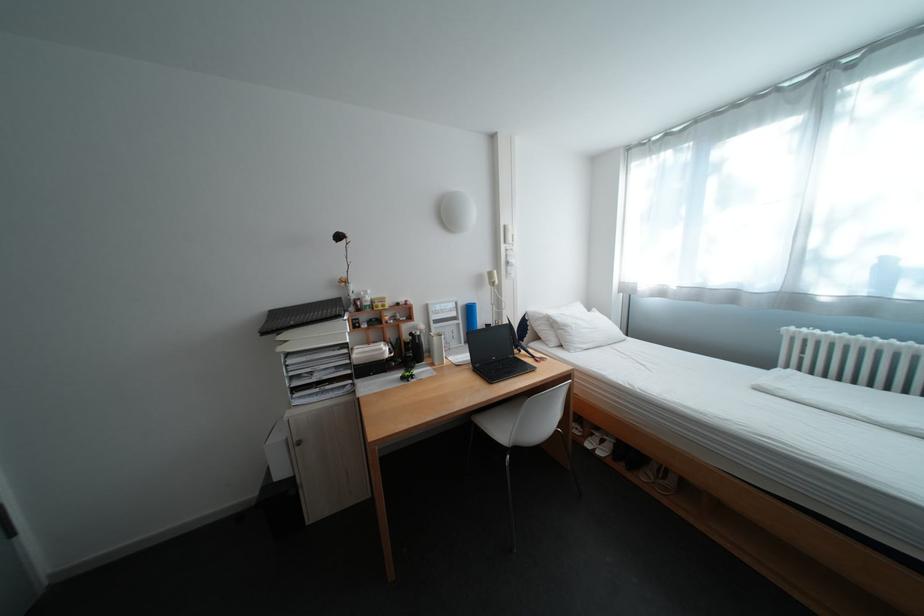
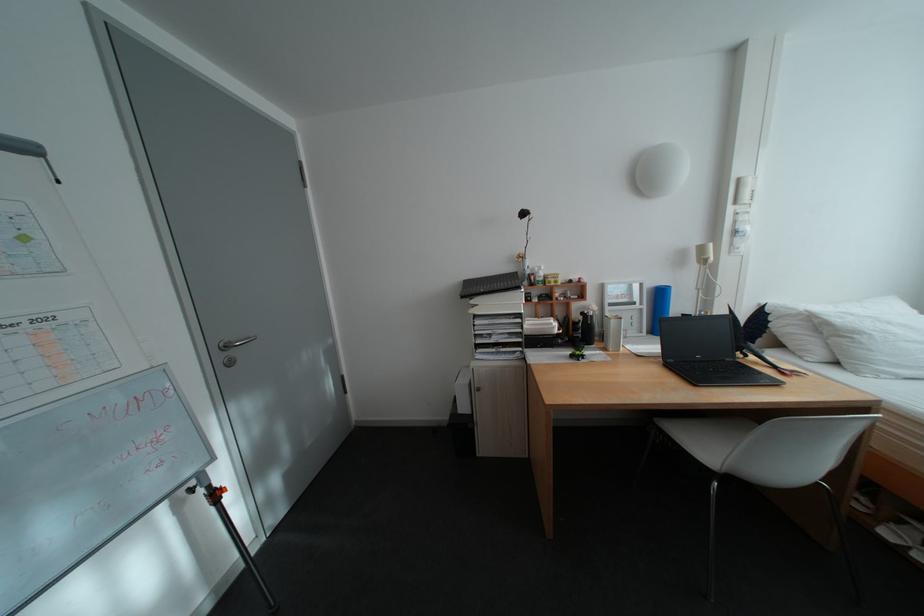
Where in the second image is the point corresponding to [504,326] from the first image?

(703, 315)